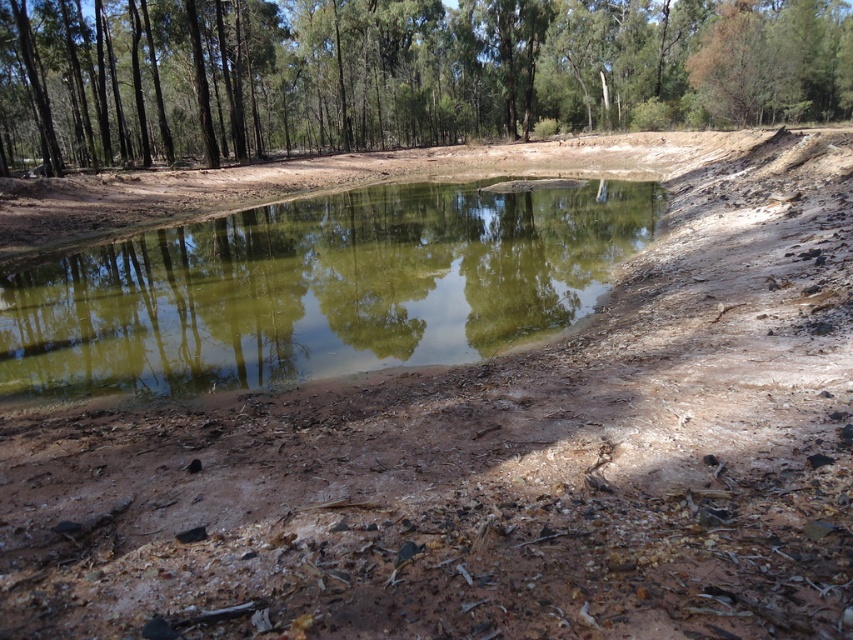
Question: Can you confirm if green leafy tree at upper center is positioned above green reflective water at center?

Choices:
 (A) no
 (B) yes

Answer: (B)

Question: Is green leafy tree at upper center closer to camera compared to green reflective water at center?

Choices:
 (A) yes
 (B) no

Answer: (B)

Question: Can you confirm if green leafy tree at upper center is wider than green reflective water at center?

Choices:
 (A) no
 (B) yes

Answer: (B)